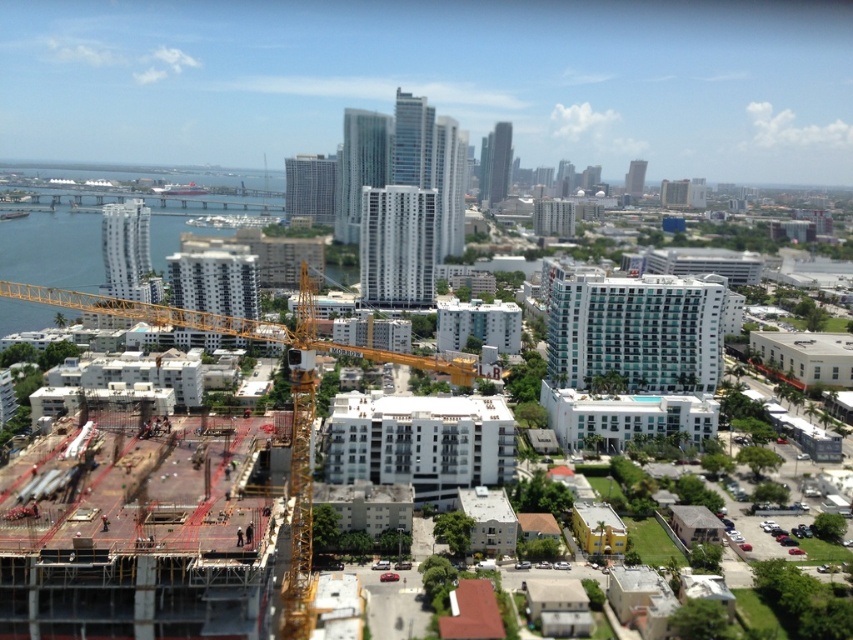
Question: Which of the following is the closest to the observer?

Choices:
 (A) blue glass water at left
 (B) yellow metallic crane at center-left

Answer: (B)

Question: Can you confirm if blue glass water at left is positioned to the right of yellow metallic crane at center-left?

Choices:
 (A) yes
 (B) no

Answer: (B)

Question: Which point is farther to the camera?

Choices:
 (A) blue glass water at left
 (B) yellow metallic crane at center-left

Answer: (A)

Question: Among these objects, which one is nearest to the camera?

Choices:
 (A) yellow metallic crane at center-left
 (B) blue glass water at left

Answer: (A)

Question: Is blue glass water at left to the left of yellow metallic crane at center-left from the viewer's perspective?

Choices:
 (A) yes
 (B) no

Answer: (A)

Question: Can you confirm if blue glass water at left is positioned to the right of yellow metallic crane at center-left?

Choices:
 (A) yes
 (B) no

Answer: (B)